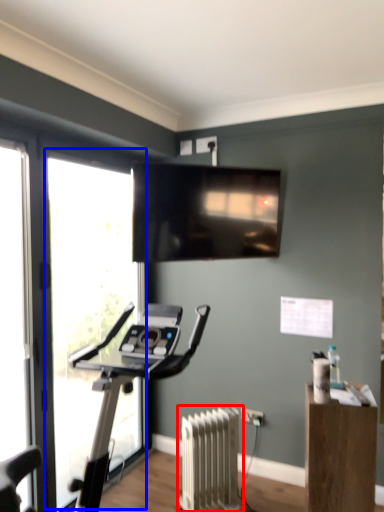
Question: Which point is closer to the camera, radiator (highlighted by a red box) or window (highlighted by a blue box)?

Choices:
 (A) radiator
 (B) window

Answer: (B)